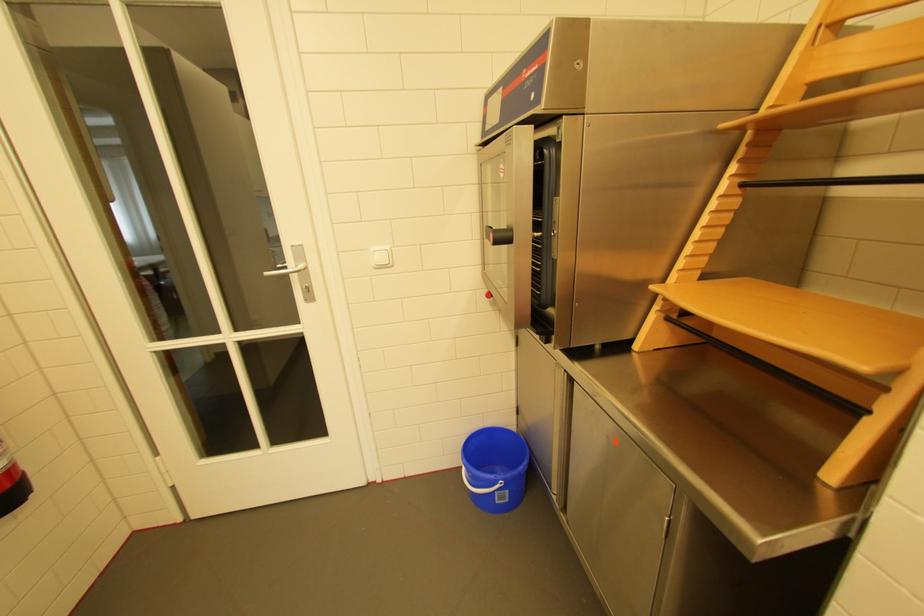
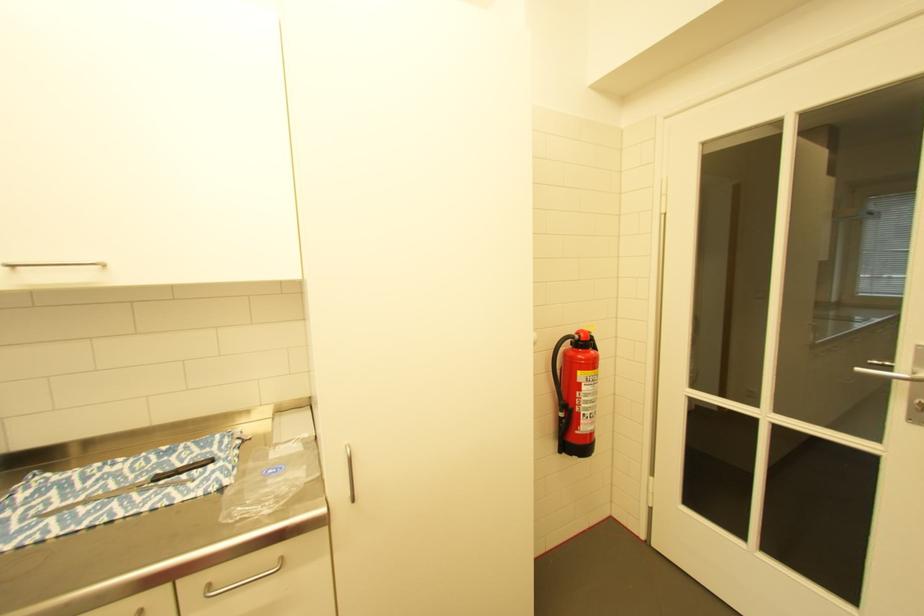
Question: The images are taken continuously from a first-person perspective. In which direction is your viewpoint rotating?

Choices:
 (A) Left
 (B) Right
 (C) Up
 (D) Down

Answer: (A)